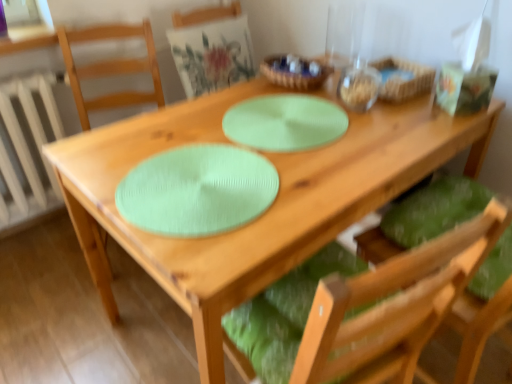
The height and width of the screenshot is (384, 512). I want to click on free space that is in between mint green textured placemat at center and green textured placemat at center, so click(x=252, y=149).